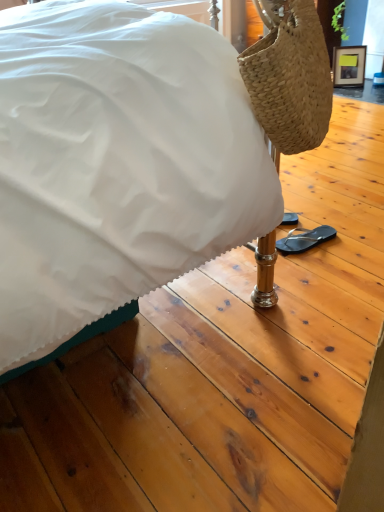
Image resolution: width=384 pixels, height=512 pixels. Describe the element at coordinates (289, 76) in the screenshot. I see `natural woven handbag at right` at that location.

Find the location of `natural woven handbag at right`. natural woven handbag at right is located at coordinates (289, 76).

At what (x,y) coordinates should I click in order to perform the action: click on natural woven handbag at right. Please return your answer as a coordinate pair (x, y). This screenshot has height=512, width=384. Looking at the image, I should click on (289, 76).